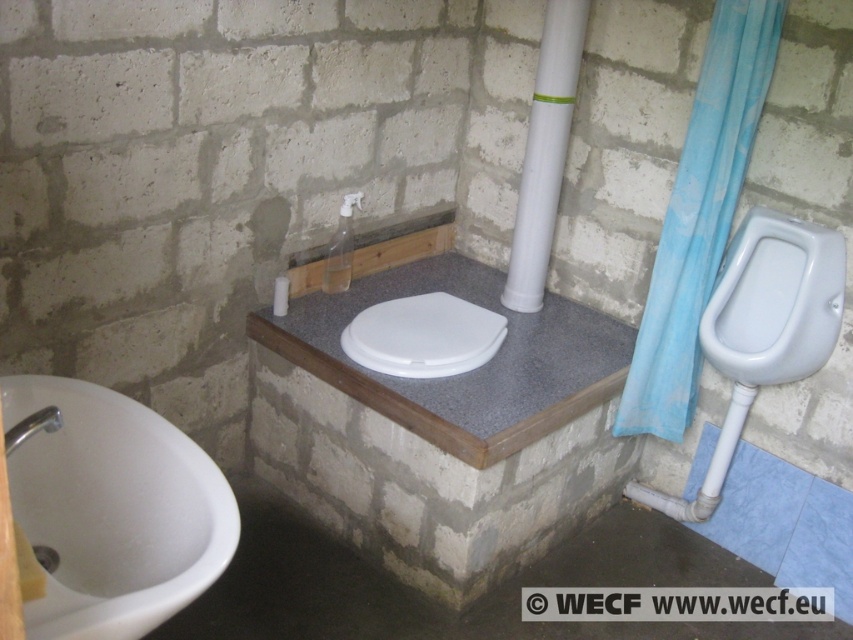
Question: Does white glossy urinal at right appear on the right side of white plastic pipe at center?

Choices:
 (A) yes
 (B) no

Answer: (A)

Question: Where is blue fabric curtain at right located in relation to white glossy urinal at right in the image?

Choices:
 (A) right
 (B) left

Answer: (B)

Question: Which of these objects is positioned closest to the white plastic bidet at center?

Choices:
 (A) white glossy urinal at right
 (B) white glossy sink at lower left
 (C) white plastic pipe at center

Answer: (C)

Question: Among these points, which one is nearest to the camera?

Choices:
 (A) tap(511, 312)
 (B) tap(755, 48)
 (C) tap(384, 355)

Answer: (B)

Question: Which point appears farthest from the camera in this image?

Choices:
 (A) (570, 113)
 (B) (685, 339)
 (C) (186, 532)

Answer: (A)

Question: Where is gray laminate toilet at center located in relation to white plastic pipe at center in the image?

Choices:
 (A) right
 (B) left

Answer: (B)